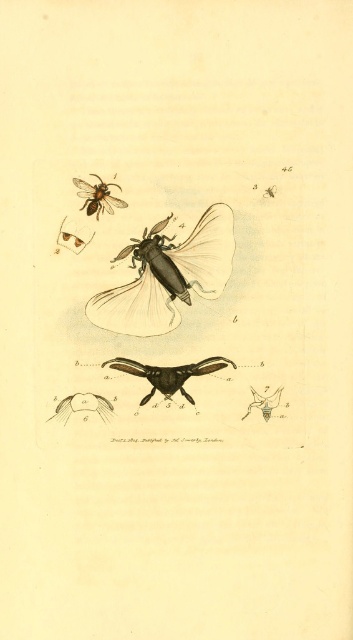
You are an entomologist examining the botanical illustration. You need to focus on the matte black insect at center and the smooth brown feather at lower left. Which object appears closer to you in the illustration?

The matte black insect at center is closer to the viewer than the smooth brown feather at lower left.

You are examining a botanical illustration of insects. The image has a point labeled at coordinates (168,275). What object is located at that point?

The point at coordinates (168,275) corresponds to the matte black insect at center.